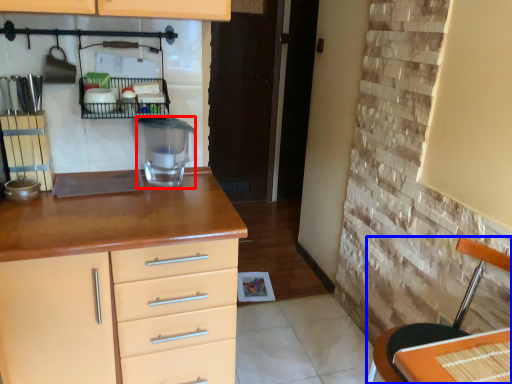
Question: Which object is closer to the camera taking this photo, appliance (highlighted by a red box) or chair (highlighted by a blue box)?

Choices:
 (A) appliance
 (B) chair

Answer: (B)